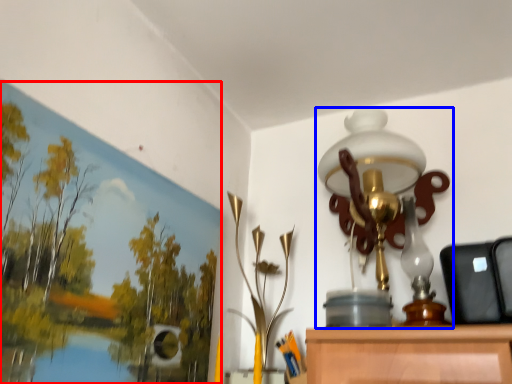
Question: Which object is further to the camera taking this photo, oil painting (highlighted by a red box) or lamp (highlighted by a blue box)?

Choices:
 (A) oil painting
 (B) lamp

Answer: (B)